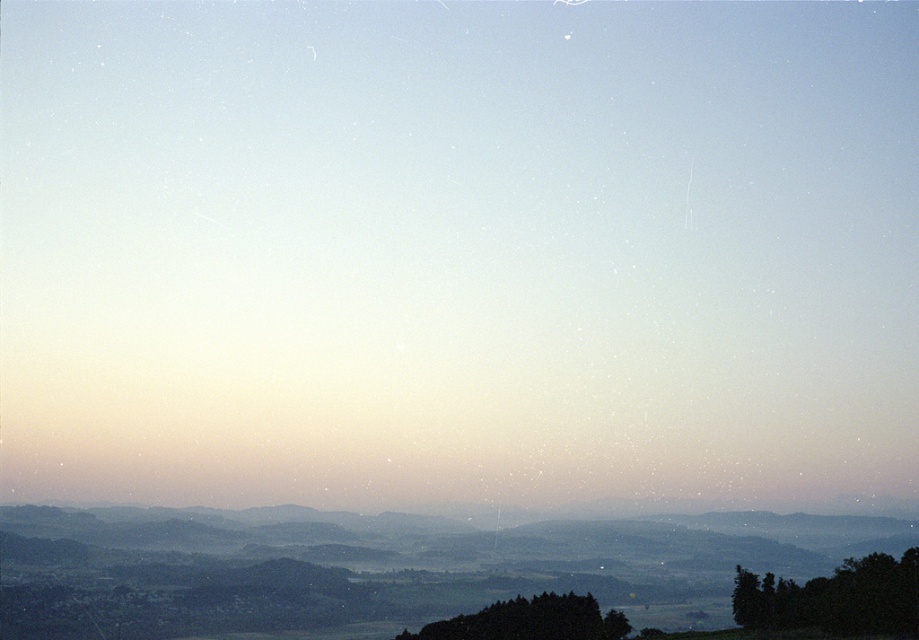
Question: Which point is farther to the camera?

Choices:
 (A) dark green textured tree at lower center
 (B) green leafy tree at lower right

Answer: (A)

Question: Does green leafy tree at lower right have a greater width compared to dark green textured tree at lower center?

Choices:
 (A) yes
 (B) no

Answer: (B)

Question: Does green leafy tree at lower right have a smaller size compared to dark green textured tree at lower center?

Choices:
 (A) yes
 (B) no

Answer: (B)

Question: Can you confirm if green leafy tree at lower right is positioned below dark green textured tree at lower center?

Choices:
 (A) no
 (B) yes

Answer: (A)

Question: Which point appears closest to the camera in this image?

Choices:
 (A) (461, 628)
 (B) (734, 596)

Answer: (B)